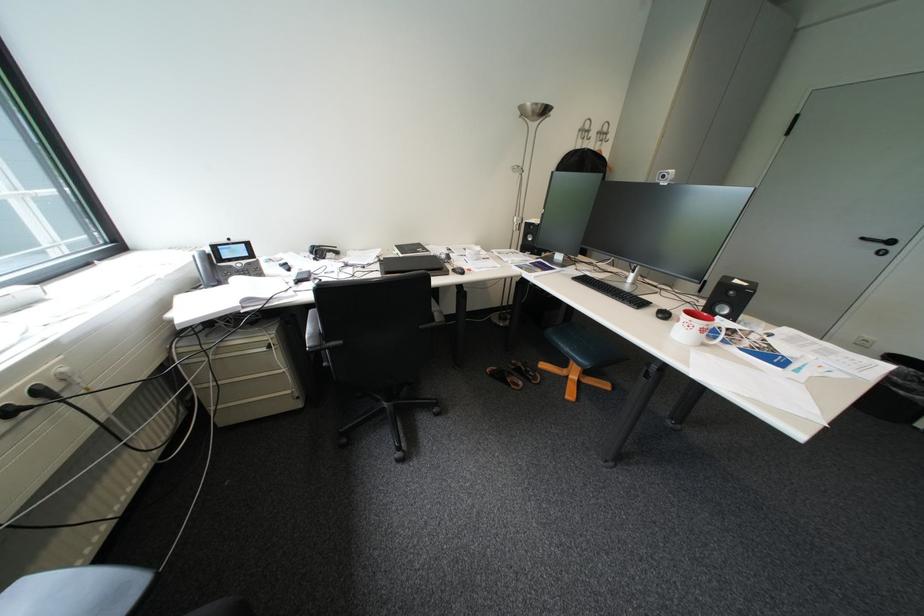
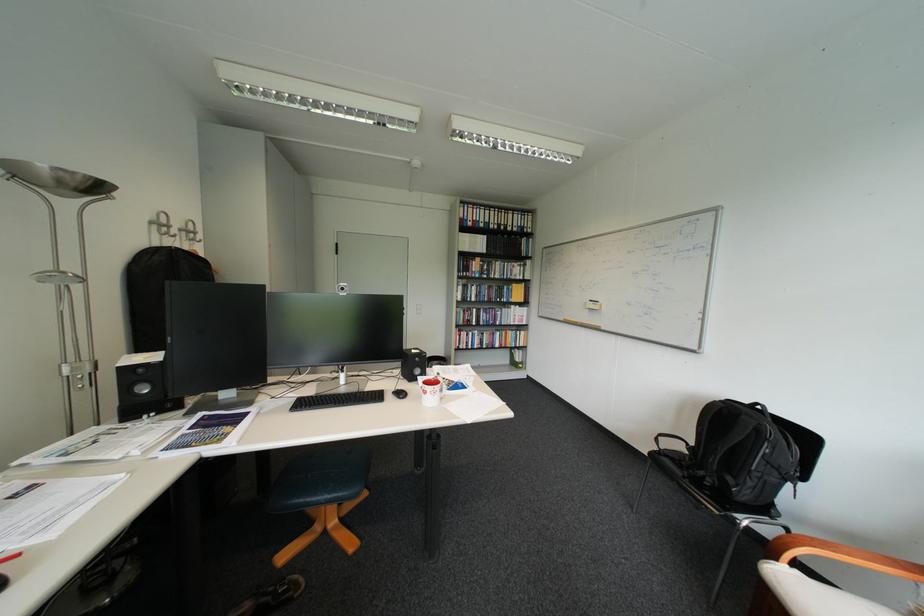
Where in the second image is the point corresponding to [585,150] from the first image?

(160, 246)